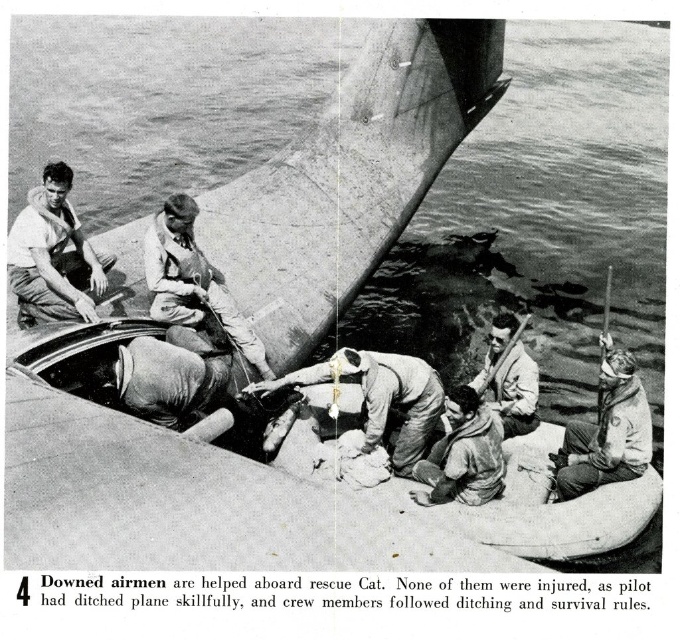
Looking at this image, between white fabric life vest at center and light brown fabric sailor at center, which one appears on the right side from the viewer's perspective?

From the viewer's perspective, white fabric life vest at center appears more on the right side.

Describe the element at coordinates (379, 397) in the screenshot. I see `white fabric life vest at center` at that location.

The width and height of the screenshot is (680, 640). I want to click on white fabric life vest at center, so click(x=379, y=397).

Does smooth white shirt at left appear over white fabric life vest at center?

Yes.

Who is more distant from viewer, [20,292] or [442,401]?

Point [20,292]

The image size is (680, 640). What are the coordinates of `smooth white shirt at left` in the screenshot? It's located at point(52,256).

Between light gray fabric life vest at lower right and light brown fabric sailor at center, which one appears on the left side from the viewer's perspective?

light brown fabric sailor at center is more to the left.

Does light gray fabric life vest at lower right have a greater width compared to light brown fabric sailor at center?

Incorrect, light gray fabric life vest at lower right's width does not surpass light brown fabric sailor at center's.

Is point (600, 340) more distant than point (171, 298)?

No.

The image size is (680, 640). In order to click on light gray fabric life vest at lower right in this screenshot , I will do `click(607, 432)`.